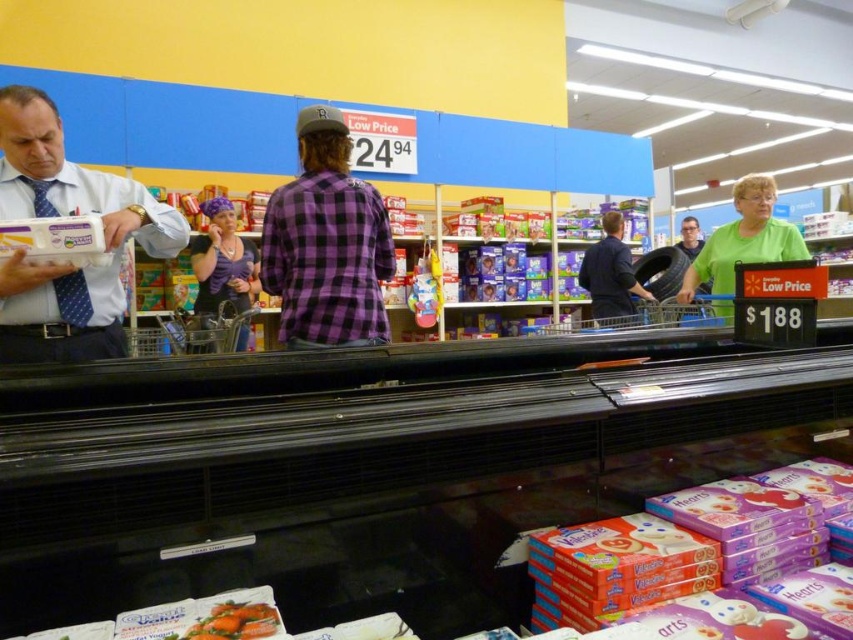
Question: Does green matte shirt at upper right appear under purple plaid shirt at center?

Choices:
 (A) no
 (B) yes

Answer: (B)

Question: Which object is farther from the camera taking this photo?

Choices:
 (A) matte blue tie at left
 (B) purple checkered shirt at center

Answer: (B)

Question: Does green matte shirt at upper right appear on the right side of rubber tire at center?

Choices:
 (A) no
 (B) yes

Answer: (B)

Question: Is purple plaid shirt at center wider than smooth orange carrots at lower left?

Choices:
 (A) no
 (B) yes

Answer: (B)

Question: Which object is positioned farthest from the purple plaid shirt at center?

Choices:
 (A) purple checkered shirt at center
 (B) rubber tire at center

Answer: (B)

Question: Which point is farther to the camera?

Choices:
 (A) purple checkered shirt at center
 (B) green matte shirt at upper right

Answer: (B)